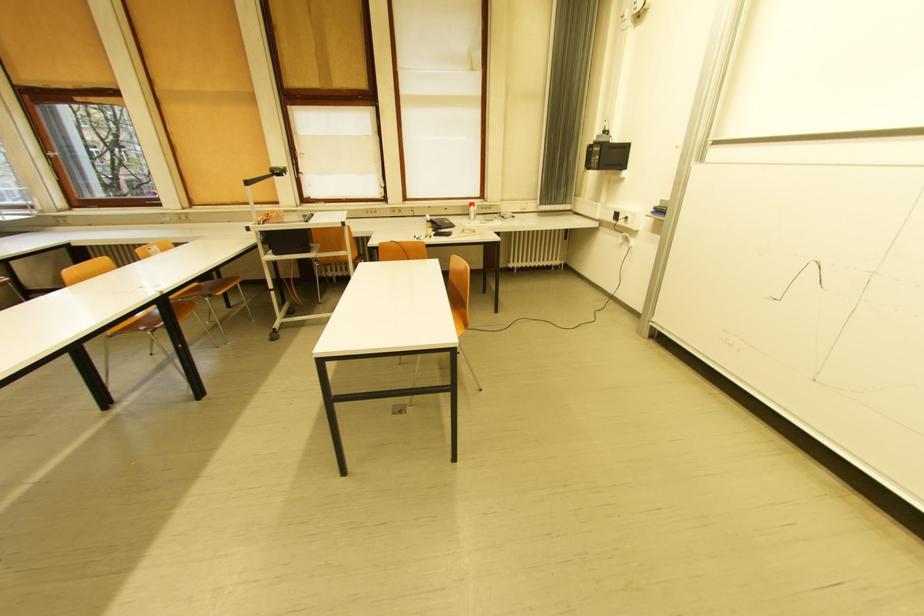
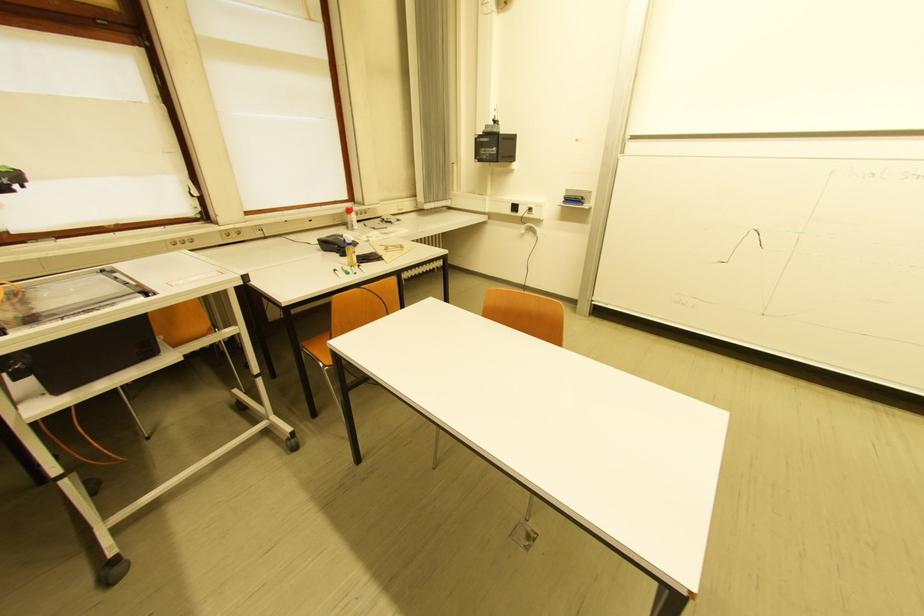
In the second image, find the point that corresponds to (x=476, y=216) in the first image.

(351, 225)